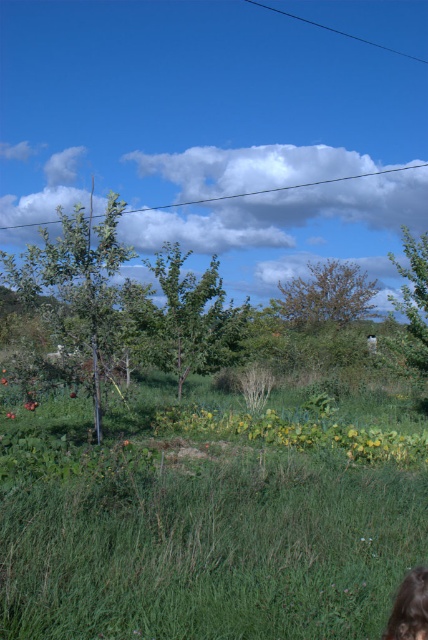
Question: Can you confirm if green leafy tree at left is thinner than green leafy tree at right?

Choices:
 (A) yes
 (B) no

Answer: (B)

Question: Which object is closer to the camera taking this photo?

Choices:
 (A) green leafy tree at left
 (B) brown textured tree at center
 (C) green leafy tree at center

Answer: (A)

Question: Is brown textured tree at center above brown hair at lower right?

Choices:
 (A) no
 (B) yes

Answer: (B)

Question: Does green leafy tree at left appear on the left side of brown textured tree at center?

Choices:
 (A) yes
 (B) no

Answer: (A)

Question: Considering the real-world distances, which object is closest to the green leafy tree at center?

Choices:
 (A) brown hair at lower right
 (B) brown textured tree at center

Answer: (B)

Question: Which object is positioned farthest from the green grassy field at lower center?

Choices:
 (A) brown hair at lower right
 (B) green leafy tree at center

Answer: (A)